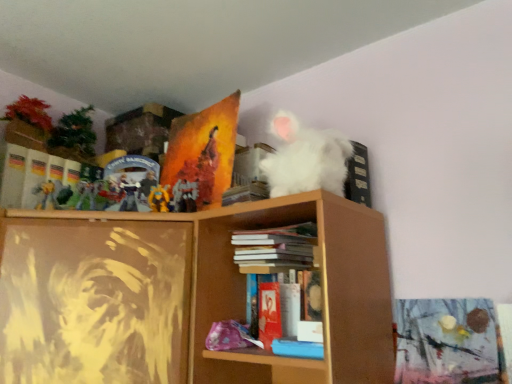
Question: In which direction should I rotate to look at matte red paperback book at center, the second paperback book from the back?

Choices:
 (A) right
 (B) left

Answer: (A)

Question: Can you confirm if blue matte book at lower center, which appears as the 2th book when viewed from the top, is smaller than hardcover book at center, the second book ordered from the bottom?

Choices:
 (A) yes
 (B) no

Answer: (A)

Question: Is blue matte book at lower center, the second book viewed from the back, to the left of hardcover book at center, positioned as the 2th book in front-to-back order, from the viewer's perspective?

Choices:
 (A) yes
 (B) no

Answer: (B)

Question: Could hardcover book at center, which appears as the first book when viewed from the back, be considered to be inside blue matte book at lower center, the 1th book positioned from the bottom?

Choices:
 (A) no
 (B) yes

Answer: (A)

Question: Is blue matte book at lower center, the second book viewed from the back, closer to the viewer compared to hardcover book at center, the 1th book from the top?

Choices:
 (A) no
 (B) yes

Answer: (B)

Question: Could you tell me if blue matte book at lower center, the 1th book positioned from the bottom, is turned towards hardcover book at center, which appears as the first book when viewed from the back?

Choices:
 (A) no
 (B) yes

Answer: (A)

Question: Is blue matte book at lower center, acting as the 1th book starting from the front, outside of hardcover book at center, the second book ordered from the bottom?

Choices:
 (A) yes
 (B) no

Answer: (A)

Question: Can you confirm if hardcover book at center, positioned as the 2th book in front-to-back order, is taller than matte orange painting at upper center, marked as the 1th paperback book in a top-to-bottom arrangement?

Choices:
 (A) no
 (B) yes

Answer: (A)

Question: Is hardcover book at center, the second book ordered from the bottom, far away from matte orange painting at upper center, marked as the 2th paperback book in a front-to-back arrangement?

Choices:
 (A) no
 (B) yes

Answer: (A)

Question: Can we say hardcover book at center, positioned as the 2th book in front-to-back order, lies outside matte orange painting at upper center, marked as the 1th paperback book in a top-to-bottom arrangement?

Choices:
 (A) no
 (B) yes

Answer: (B)

Question: Is hardcover book at center, which appears as the first book when viewed from the back, facing away from matte orange painting at upper center, placed as the second paperback book when sorted from bottom to top?

Choices:
 (A) no
 (B) yes

Answer: (A)

Question: Does hardcover book at center, which appears as the first book when viewed from the back, come in front of matte orange painting at upper center, which is counted as the 1th paperback book, starting from the back?

Choices:
 (A) no
 (B) yes

Answer: (B)

Question: From the image's perspective, is hardcover book at center, positioned as the 2th book in front-to-back order, beneath matte orange painting at upper center, marked as the 2th paperback book in a front-to-back arrangement?

Choices:
 (A) no
 (B) yes

Answer: (B)

Question: Are metallic gold action figure at upper center and blue matte book at lower center, the second book viewed from the back, far apart?

Choices:
 (A) no
 (B) yes

Answer: (A)